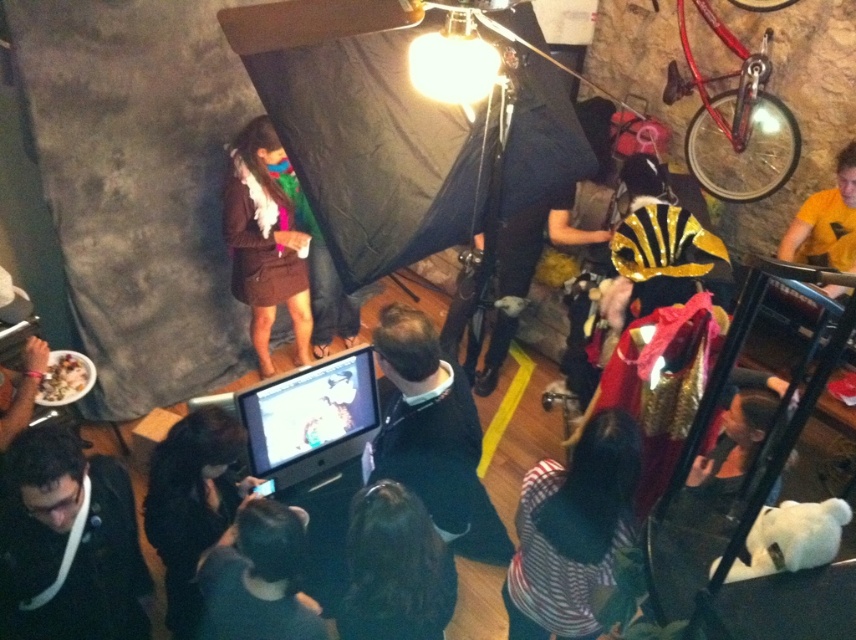
Question: Which object appears farthest from the camera in this image?

Choices:
 (A) dark fabric mask at lower center
 (B) black matte camera at center
 (C) shiny black monitor at center
 (D) white matte bowl at center

Answer: (D)

Question: Can you confirm if striped fabric dress at lower center is wider than black matte monitor at center?

Choices:
 (A) no
 (B) yes

Answer: (A)

Question: Estimate the real-world distances between objects in this image. Which object is closer to the white matte bowl at center?

Choices:
 (A) black matte camera at center
 (B) black matte monitor at center
 (C) dark fabric mask at lower center
 (D) yellow matte shirt at upper right

Answer: (A)

Question: Is black matte monitor at center to the left of dark hair at center from the viewer's perspective?

Choices:
 (A) no
 (B) yes

Answer: (A)

Question: Which point appears farthest from the camera in this image?

Choices:
 (A) (22, 416)
 (B) (458, 554)
 (C) (825, 204)

Answer: (C)

Question: Does black matte monitor at center have a larger size compared to gold metallic mask at lower right?

Choices:
 (A) yes
 (B) no

Answer: (A)